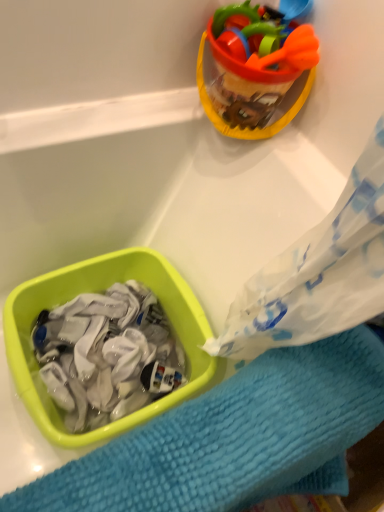
The image size is (384, 512). Find the location of `free spot above blue textured towel at lower center (from a real-world perspective)`. free spot above blue textured towel at lower center (from a real-world perspective) is located at coordinates (248, 428).